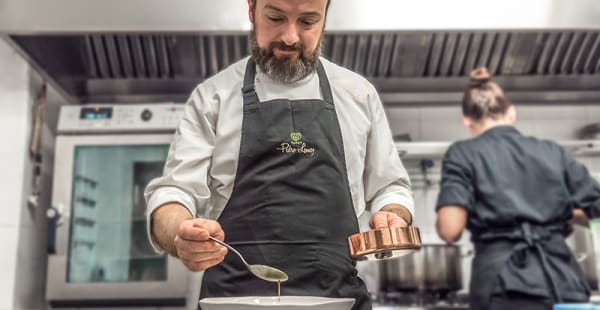
Image resolution: width=600 pixels, height=310 pixels. I want to click on vents, so click(136, 54), click(228, 50), click(364, 50), click(478, 51), click(566, 61).